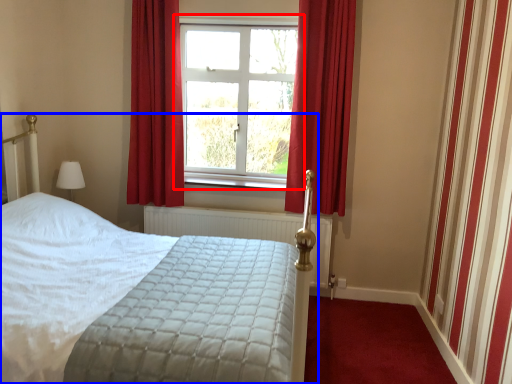
Question: Which object is closer to the camera taking this photo, window (highlighted by a red box) or bed (highlighted by a blue box)?

Choices:
 (A) window
 (B) bed

Answer: (B)